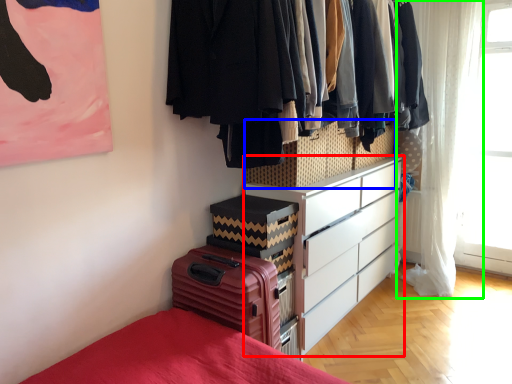
Question: Considering the real-world distances, which object is closest to chest of drawers (highlighted by a red box)? cabinetry (highlighted by a blue box) or curtain (highlighted by a green box).

Choices:
 (A) cabinetry
 (B) curtain

Answer: (A)